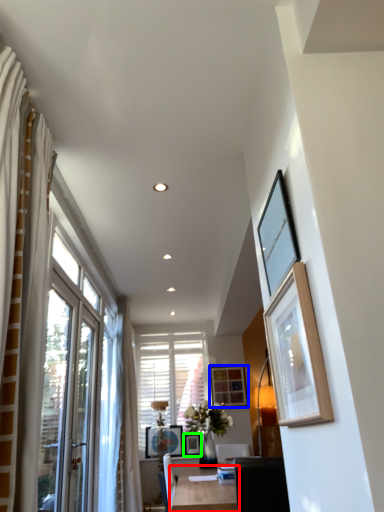
Question: Which is nearer to the table (highlighted by a red box)? picture frame (highlighted by a blue box) or picture frame (highlighted by a green box).

Choices:
 (A) picture frame
 (B) picture frame

Answer: (B)